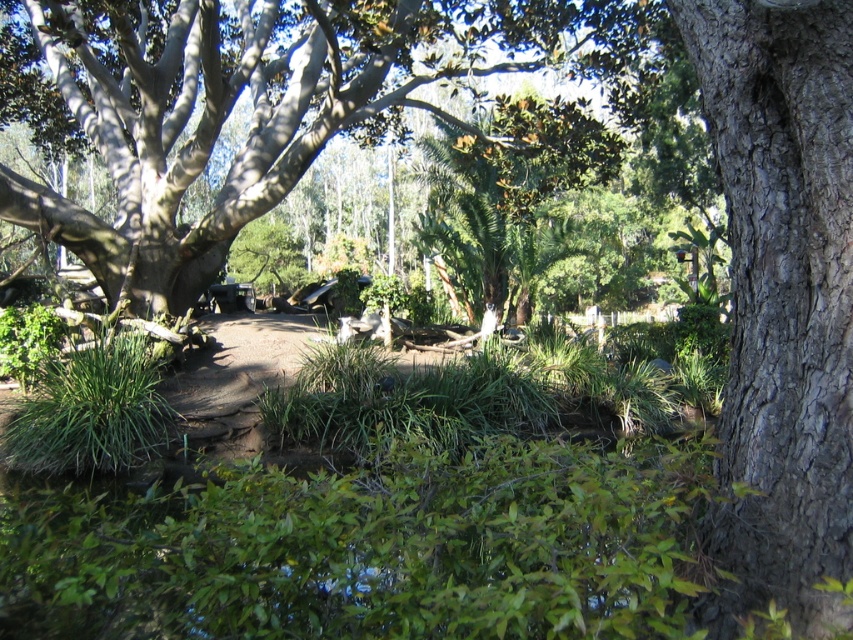
You are a park ranger planning to plant new trees along the dirt path in the scene. You have two types of trees available for planting. One is the smooth gray bark tree at upper left and the other is the gray textured bark tree at right. Which tree should you choose if you want to create a more imposing presence near the path?

The smooth gray bark tree at upper left is larger in size than the gray textured bark tree at right, so choosing the smooth gray bark tree at upper left would create a more imposing presence near the path due to its larger size.

You are a park ranger planning to place a new bench along the dirt path. The smooth gray bark tree at upper left is located at point (x=254, y=106). Where should you place the bench so it is closest to the tree without being under its shadow?

The bench should be placed near the point (x=254, y=106) where the smooth gray bark tree at upper left is located, ensuring it is not under the tree shadow. Since the tree shadow is cast across the ground, positioning the bench closer to the tree trunk away from the shadow area would be ideal.